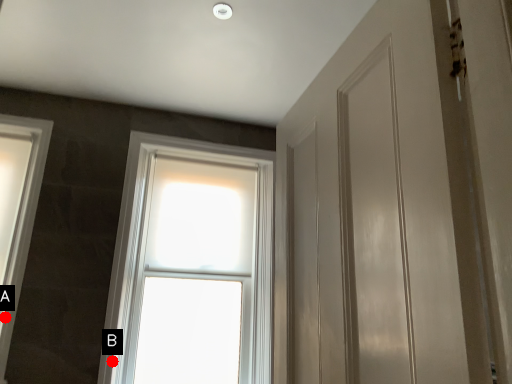
Question: Two points are circled on the image, labeled by A and B beside each circle. Which point appears farthest from the camera in this image?

Choices:
 (A) A is further
 (B) B is further

Answer: (B)